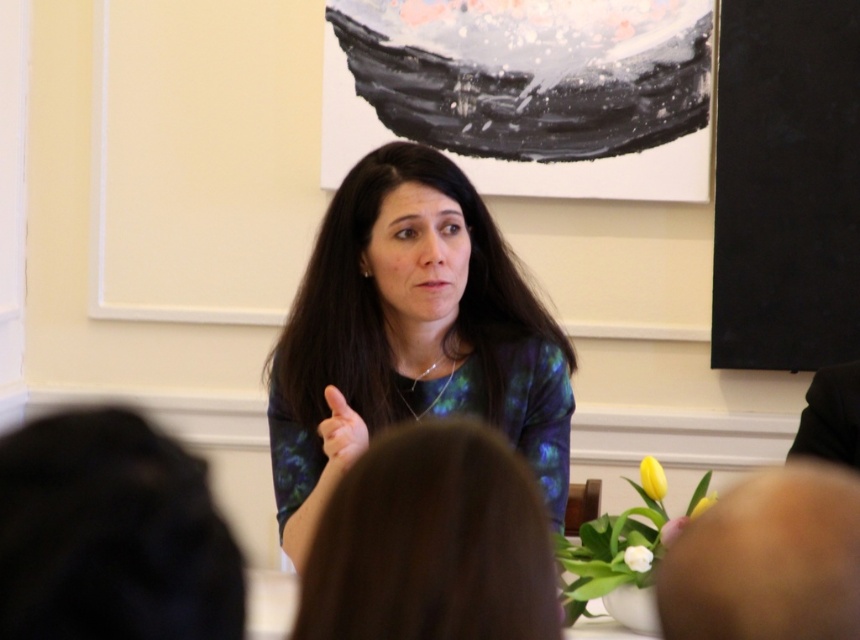
You are attending a meeting and need to identify the clothing items worn by the central figure. Which clothing item is closer to you between the blue printed shirt at center and the shiny blue dress at center?

The blue printed shirt at center is closer to you since it is positioned in front of the shiny blue dress at center.

You are organizing a photo shoot and need to decide which clothing item to feature in the final image. The scene shows a woman wearing both a blue printed shirt at center and a shiny blue dress at center. Based on their positions, which clothing item is positioned higher on her body?

The blue printed shirt at center is taller than the shiny blue dress at center, so the blue printed shirt at center is positioned higher on her body.

You are standing in the room and want to locate the blue printed shirt at center. Where is it positioned in the room?

The blue printed shirt at center is positioned at the center of the room, specifically at the coordinates point (409, 336).